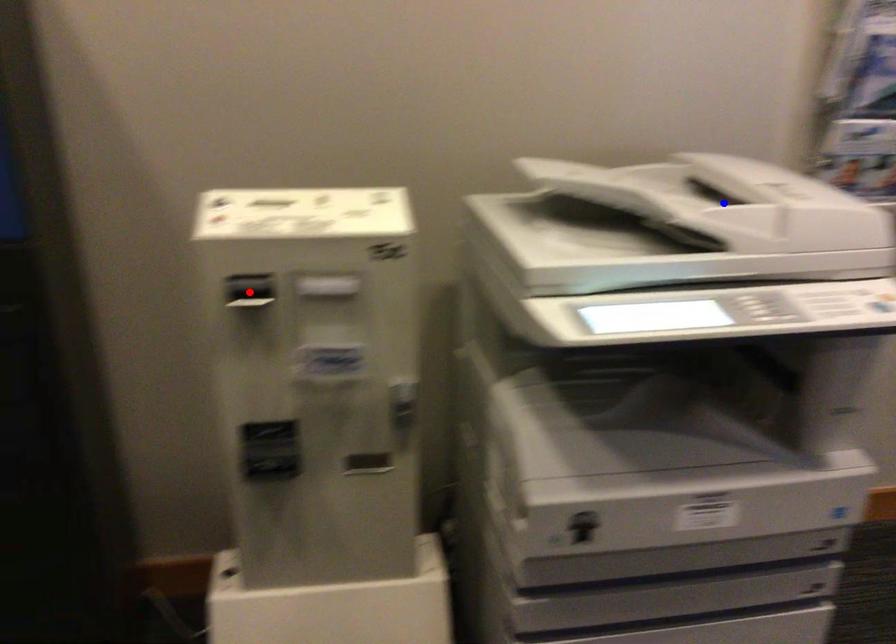
Question: Which of the two points in the image is closer to the camera?

Choices:
 (A) Blue point is closer.
 (B) Red point is closer.

Answer: (B)